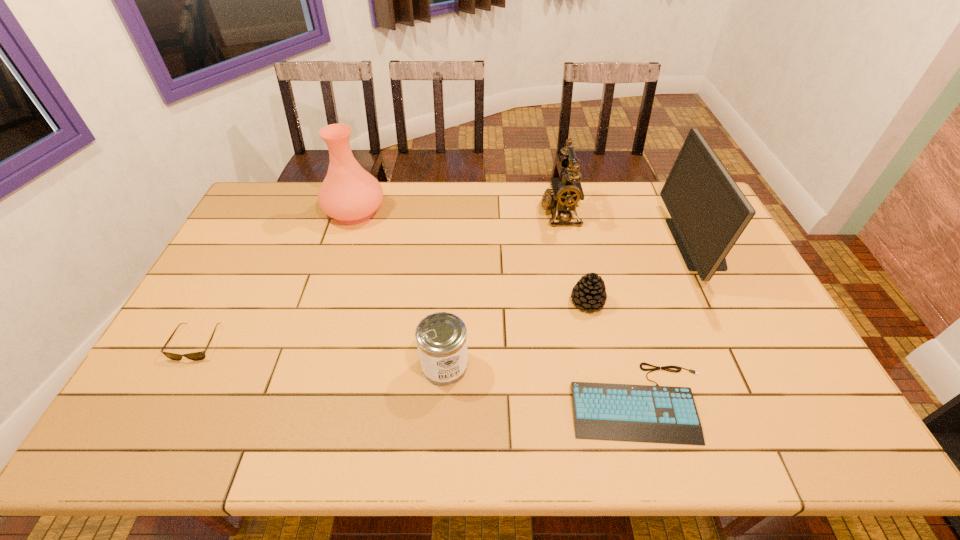
The image size is (960, 540). I want to click on the second object from left to right, so click(349, 194).

This screenshot has width=960, height=540. I want to click on computer monitor, so click(709, 212).

The height and width of the screenshot is (540, 960). I want to click on telephone, so click(566, 193).

Find the location of a particular element. the fifth object from right to left is located at coordinates (441, 337).

Where is `can`? can is located at coordinates (441, 337).

Find the location of a particular element. pinecone is located at coordinates (589, 293).

In order to click on sunglasses in this screenshot , I will do `click(196, 356)`.

Locate an element on the screen. This screenshot has height=540, width=960. the leftmost object is located at coordinates (196, 356).

This screenshot has height=540, width=960. I want to click on the shortest object, so click(x=642, y=413).

Find the location of `free spot located 0.340m on the front of the vase`. free spot located 0.340m on the front of the vase is located at coordinates (324, 307).